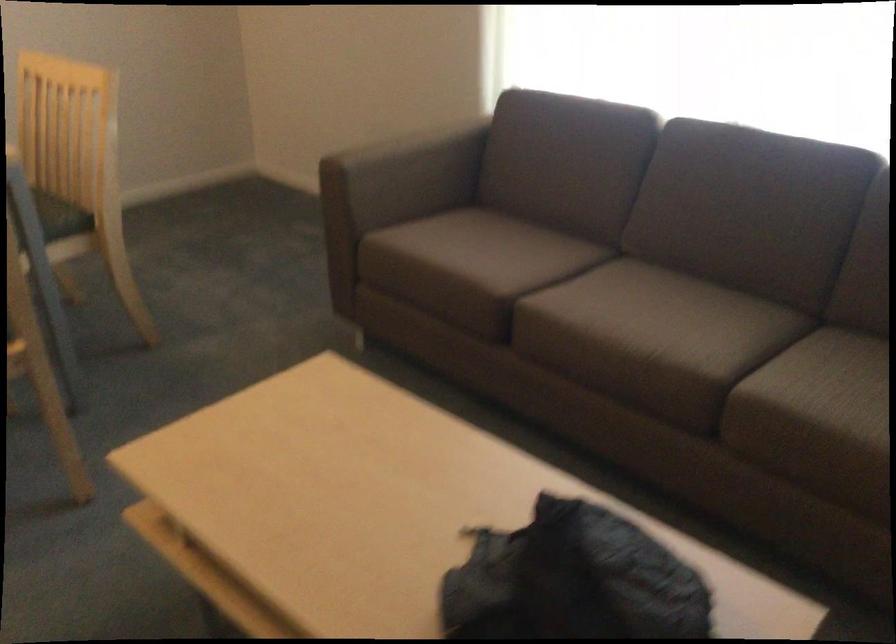
The width and height of the screenshot is (896, 644). What do you see at coordinates (726, 368) in the screenshot?
I see `the sofa sitting surface` at bounding box center [726, 368].